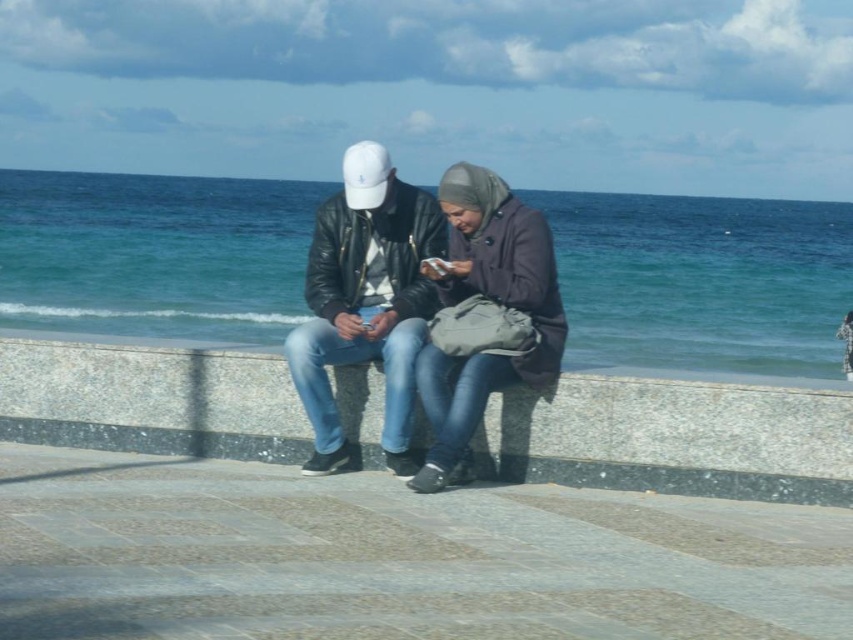
You are a delivery robot with a 1.2 meter wide package. You need to move between the gray concrete ledge at center and the matte purple coat at center. Can you fit through the space between them?

The distance between the gray concrete ledge at center and the matte purple coat at center is 1.28 meters. Since the package is 1.2 meters wide, it should fit through the space as there is enough clearance.

You are a photographer trying to capture a group photo of the leather jacket at center and the matte purple coat at center. Since you want to ensure both subjects are fully visible in the frame, which subject should you position closer to the camera to avoid being cut off?

The leather jacket at center is much taller than the matte purple coat at center, so positioning the leather jacket at center closer to the camera will ensure both are fully visible without being cut off.

You are a photographer trying to capture a wide shot of the gray concrete ledge at center and the leather jacket at center. Given that your camera can only focus on objects within a 1.5 meter width, will both objects fit within the frame?

The gray concrete ledge at center is wider than the leather jacket at center. Since the camera can focus on objects within a 1.5 meter width, both objects can fit within the frame as long as their combined width does not exceed 1.5 meters. However, the exact fit depends on their individual widths and positioning.